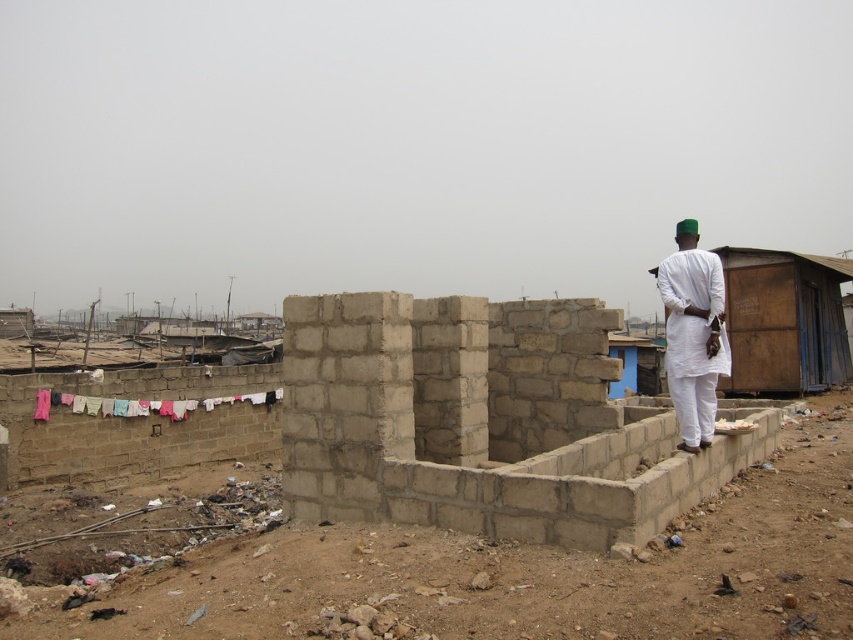
You are standing at the center of the image and want to walk towards the wooden hut at right. Which direction should you face to head directly towards it?

The wooden hut at right is located at point 0.502 on the x and 0.920 on the y coordinate. Since you are at the center, you should face towards the right and slightly downward to head directly towards the wooden hut at right.

You are a painter who needs to move a ladder from the white cotton shirt at right to the multicolored fabric at left. The ladder is 3 meters long. Can you carry it horizontally without it touching the ground?

The distance between the white cotton shirt at right and the multicolored fabric at left is 10.91 meters. Since the ladder is only 3 meters long, you can carry it horizontally between these two points without needing to touch the ground as the distance is greater than the ladder length.

You are standing in the outdoor scene and want to take a photo of the wooden hut at right and the multicolored fabric at left. Which object should you focus on first to ensure both are in the frame?

You should focus on the wooden hut at right first because it is closer to you than the multicolored fabric at left, ensuring both are in the frame by adjusting the camera angle accordingly.